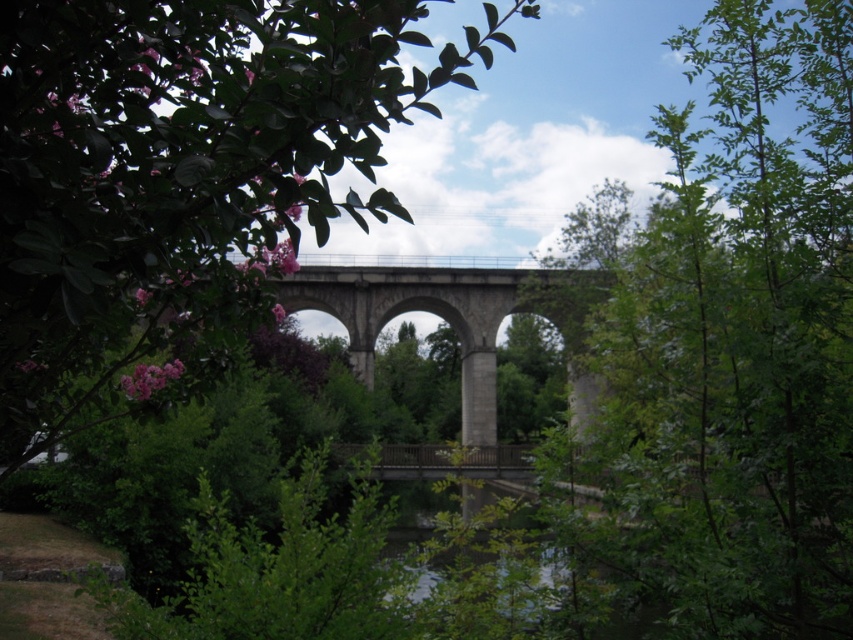
You are standing at the origin point of the image. Which direction should you move to reach the green leafy tree at center?

The green leafy tree at center is located at coordinates point (735,346), so you should move towards the center of the image to reach it.

You are standing on the stone bridge and looking towards the green leafy tree at upper center and the green leafy tree at center. Which tree is higher in the image?

The green leafy tree at upper center is higher in the image because it is located above the green leafy tree at center.